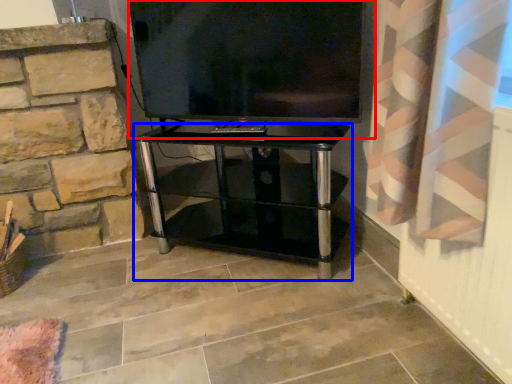
Question: Among these objects, which one is farthest to the camera, television (highlighted by a red box) or furniture (highlighted by a blue box)?

Choices:
 (A) television
 (B) furniture

Answer: (B)